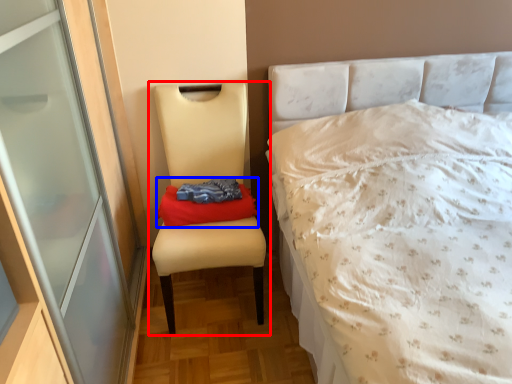
Question: Which point is further to the camera, chair (highlighted by a red box) or material (highlighted by a blue box)?

Choices:
 (A) chair
 (B) material

Answer: (B)